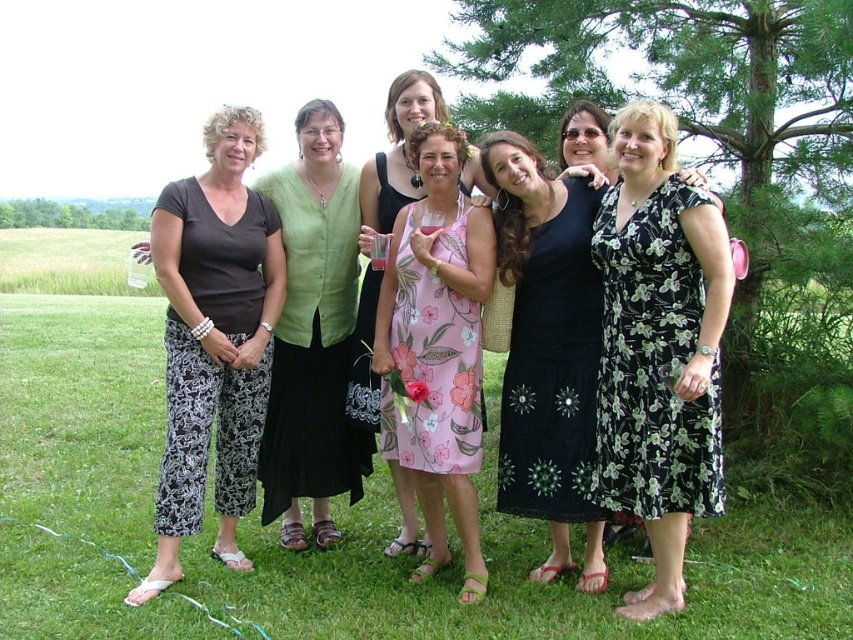
Does floral print dress at center appear under floral-patterned fabric dress at center?

Indeed, floral print dress at center is positioned under floral-patterned fabric dress at center.

How distant is floral print dress at center from floral-patterned fabric dress at center?

The distance of floral print dress at center from floral-patterned fabric dress at center is 37.40 inches.

Is point (672, 372) positioned in front of point (384, 449)?

Yes, it is in front of point (384, 449).

You are a GUI agent. You are given a task and a screenshot of the screen. Output one action in this format:
    pyautogui.click(x=<x>, y=<y>)
    Task: Click on the floral print dress at center
    Image resolution: width=853 pixels, height=640 pixels.
    Given the screenshot: What is the action you would take?
    pyautogui.click(x=653, y=364)

Is point (461, 477) farther from camera compared to point (460, 248)?

No.

Which is more to the right, floral cotton dress at center or floral-patterned fabric dress at center?

From the viewer's perspective, floral cotton dress at center appears more on the right side.

Which is in front, point (413, 132) or point (473, 451)?

Point (473, 451) is in front.

At what (x,y) coordinates should I click in order to perform the action: click on floral cotton dress at center. Please return your answer as a coordinate pair (x, y). Looking at the image, I should click on (438, 346).

Does dark gray matte pants at left have a smaller size compared to floral chiffon dress at center?

No, dark gray matte pants at left is not smaller than floral chiffon dress at center.

Is dark gray matte pants at left closer to the viewer compared to floral chiffon dress at center?

Yes.

Find the location of a particular element. The height and width of the screenshot is (640, 853). dark gray matte pants at left is located at coordinates (x=213, y=339).

At what (x,y) coordinates should I click in order to perform the action: click on dark gray matte pants at left. Please return your answer as a coordinate pair (x, y). The image size is (853, 640). Looking at the image, I should click on (213, 339).